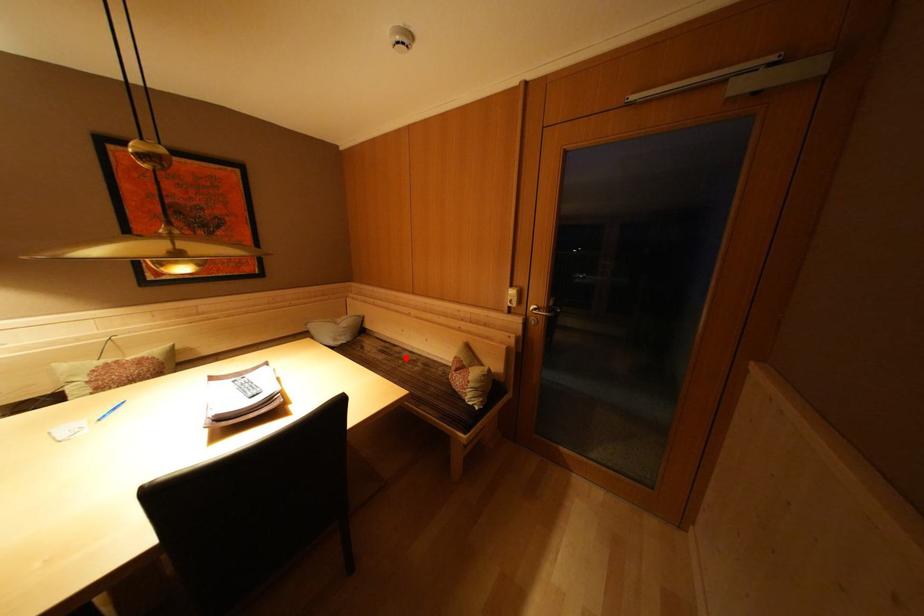
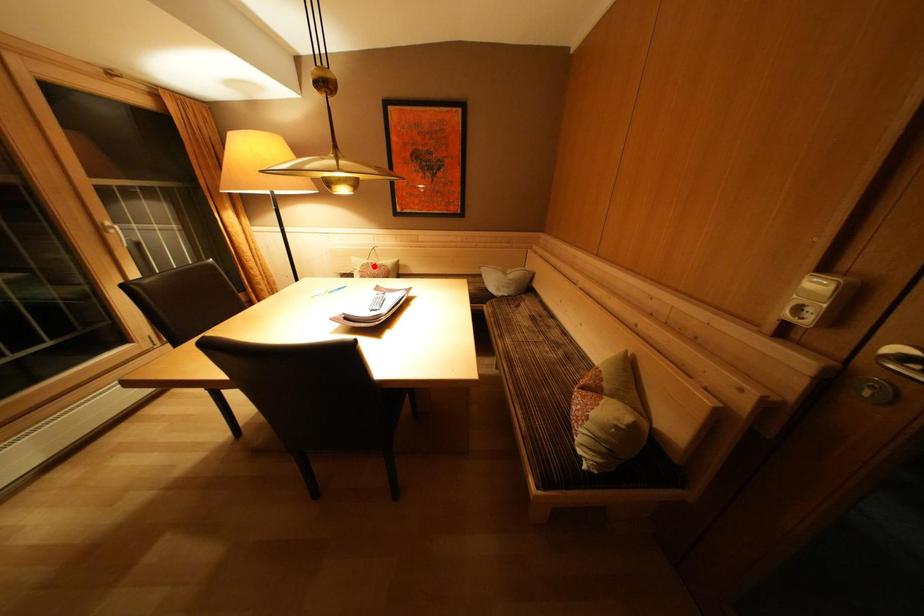
I am providing you with two images of the same scene from different viewpoints. A red point is marked on the first image and another point is marked on the second image. Does the point marked in image1 correspond to the same location as the one in image2?

No